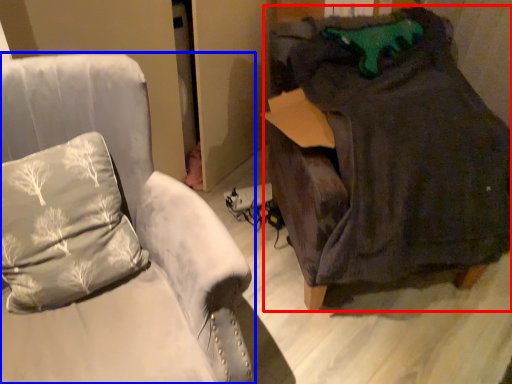
Question: Which point is closer to the camera, bean bag chair (highlighted by a red box) or furniture (highlighted by a blue box)?

Choices:
 (A) bean bag chair
 (B) furniture

Answer: (B)